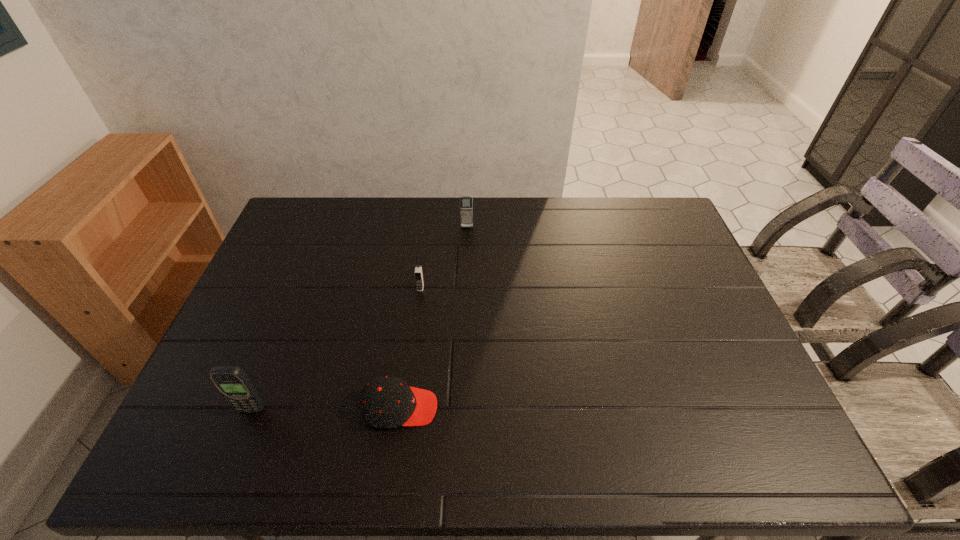
You are a GUI agent. You are given a task and a screenshot of the screen. Output one action in this format:
    pyautogui.click(x=<x>, y=<y>)
    Task: Click on the vacant position in the image that satisfies the following two spatial constraints: 1. on the front-facing side of the shortest object; 2. on the screen of the leftmost object
    
    Given the screenshot: What is the action you would take?
    pyautogui.click(x=400, y=409)

Find the location of a particular element. free location that satisfies the following two spatial constraints: 1. on the front-facing side of the farthest object; 2. on the front-facing side of the cap is located at coordinates point(461,408).